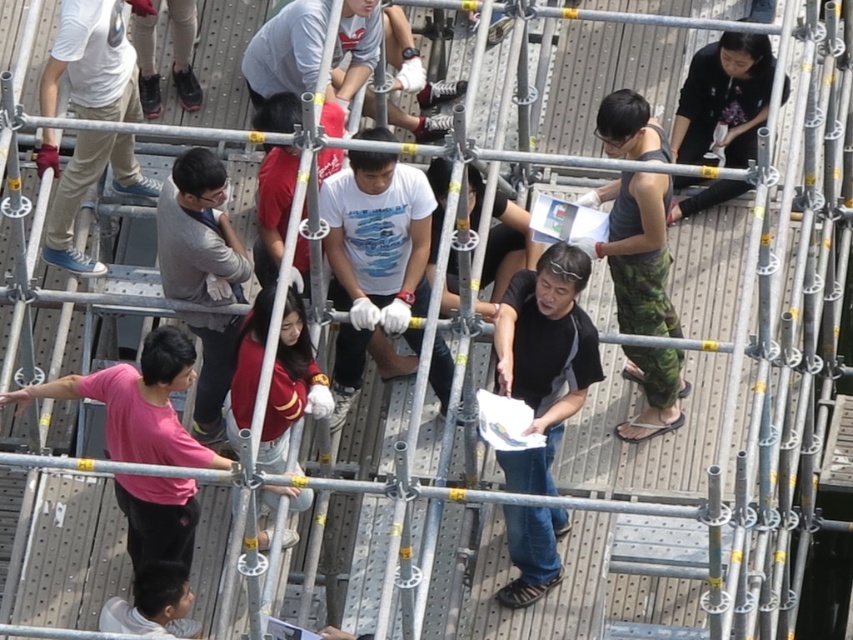
From the picture: You are a safety inspector on the construction site. You need to ensure that the workers are spaced at least 1.5 meters apart for safety. The black matte shirt at upper right and the black shirt at center are two workers you are observing. Can you determine if they are following the safety distance requirement based on their positions?

The black matte shirt at upper right might be wider than black shirt at center, but the description does not provide information about the distance between them. Therefore, it is impossible to determine if they are maintaining the required 1.5 meters of safety distance.

You are standing on the scaffolding and want to move from point A to point B. Point A is at coordinate point (740, 180) and point B is at coordinate point (439, 212). Which point is closer to you when you are facing the scaffolding?

Point B at coordinate point (439, 212) is closer to you because point A at coordinate point (740, 180) is further to the camera than point B.

You are standing on the scaffolding and want to hand a tool to the person wearing camouflage pants at right. Considering the distance, can you safely throw the tool to them without risking injury?

The camouflage pants at right is 137.03 feet away from viewer. Throwing a tool that far could be dangerous and inaccurate, so it is not recommended to throw it.